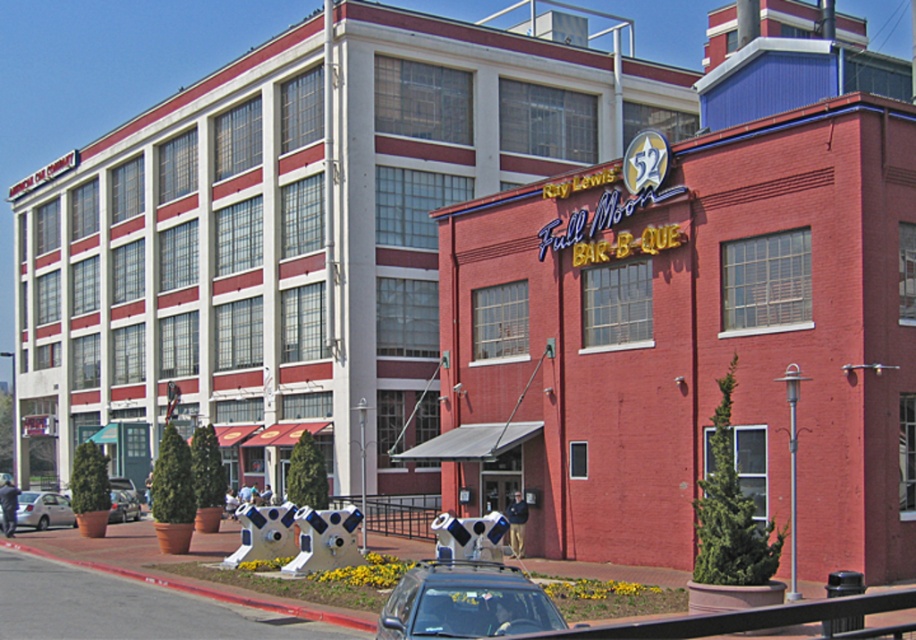
You are a delivery person who needs to park your truck in front of Ray Lewis 52 Full Moon Bar B Que. You see a silver metallic sedan at lower left and a metallic silver car at lower left. Which vehicle should you move to make space for your truck?

The silver metallic sedan at lower left is larger in size than metallic silver car at lower left, so you should move the silver metallic sedan at lower left to make more space for your truck.

You are a delivery driver who needs to park your truck in the parking lot behind the Ray Lewis 52 Full Moon Bar B Que. However, there are two cars blocking the entrance. The matte black car at center and the metallic silver car at lower left. Can you drive around them to access the parking lot entrance?

The matte black car at center is positioned over the metallic silver car at lower left, meaning it is blocking the entrance. You cannot drive around them as they are directly in the path to the parking lot entrance.